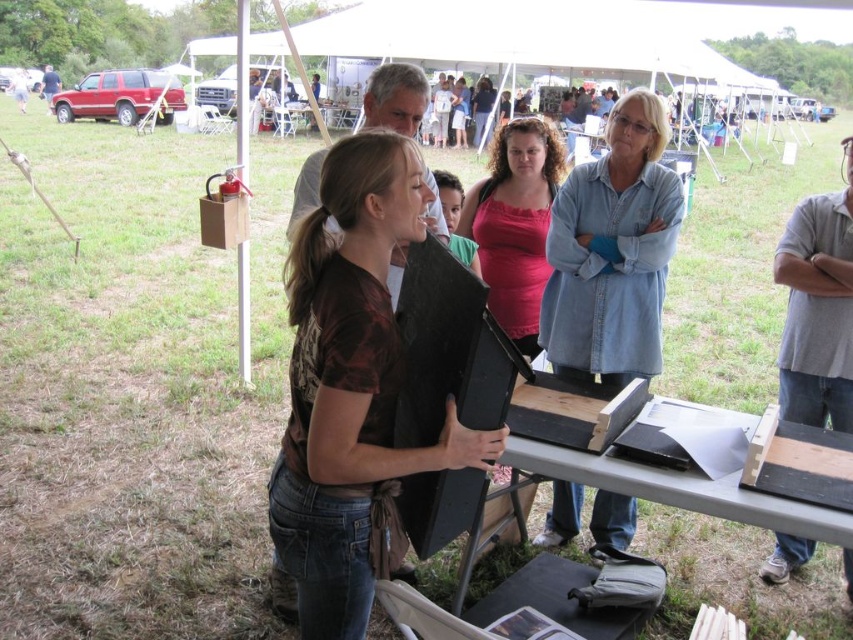
Question: Is brown textured shirt at center wider than denim shirt at upper center?

Choices:
 (A) yes
 (B) no

Answer: (A)

Question: Is matte pink tank top at center bigger than wooden table at center?

Choices:
 (A) yes
 (B) no

Answer: (B)

Question: Considering the real-world distances, which object is farthest from the brown textured shirt at center?

Choices:
 (A) wooden picnic table at center
 (B) denim shirt at upper center
 (C) matte pink tank top at center

Answer: (B)

Question: Does matte pink tank top at center come behind wooden table at center?

Choices:
 (A) yes
 (B) no

Answer: (B)

Question: Which point is closer to the camera taking this photo?

Choices:
 (A) (659, 342)
 (B) (328, 216)

Answer: (B)

Question: Which point is farther to the camera?

Choices:
 (A) denim shirt at upper center
 (B) brown textured shirt at center
 (C) wooden picnic table at center

Answer: (A)